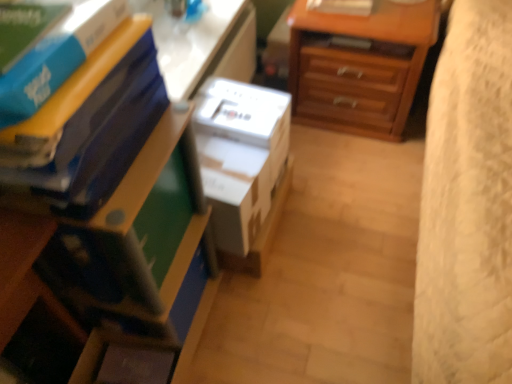
How much space does matte blue paperback book at left, the second paperback book in the back-to-front sequence, occupy horizontally?

matte blue paperback book at left, the second paperback book in the back-to-front sequence, is 12.07 inches in width.

Where is `blue matte book at upper left, the 1th paperback book in the front-to-back sequence`? blue matte book at upper left, the 1th paperback book in the front-to-back sequence is located at coordinates (57, 58).

I want to click on matte plastic nightstand at lower left, so click(127, 209).

Where is `matte blue paperback book at left, which ranks as the second paperback book in front-to-back order`? matte blue paperback book at left, which ranks as the second paperback book in front-to-back order is located at coordinates (90, 125).

Does blue matte book at upper left, the 1th paperback book in the front-to-back sequence, turn towards matte blue paperback book at left, the second paperback book in the back-to-front sequence?

No, blue matte book at upper left, the 1th paperback book in the front-to-back sequence, is not oriented towards matte blue paperback book at left, the second paperback book in the back-to-front sequence.

Consider the image. Between blue matte book at upper left, the 3th paperback book when ordered from back to front, and matte blue paperback book at left, which ranks as the second paperback book in front-to-back order, which one is positioned in front?

blue matte book at upper left, the 3th paperback book when ordered from back to front, is more forward.

Locate an element on the screen. The height and width of the screenshot is (384, 512). paperback book to the right of blue matte book at upper left, the 3th paperback book when ordered from back to front is located at coordinates (90, 125).

Does blue matte book at upper left, the 3th paperback book when ordered from back to front, appear on the right side of matte blue paperback book at left, the second paperback book in the back-to-front sequence?

Incorrect, blue matte book at upper left, the 3th paperback book when ordered from back to front, is not on the right side of matte blue paperback book at left, the second paperback book in the back-to-front sequence.

Is matte plastic nightstand at lower left placed right next to blue matte book at upper left, which appears as the 3th paperback book when viewed from the front?

No, matte plastic nightstand at lower left is not beside blue matte book at upper left, which appears as the 3th paperback book when viewed from the front.

Could blue matte book at upper left, placed as the first paperback book when sorted from back to front, be considered to be inside matte plastic nightstand at lower left?

No, blue matte book at upper left, placed as the first paperback book when sorted from back to front, is not a part of matte plastic nightstand at lower left.

Which of these two, matte plastic nightstand at lower left or blue matte book at upper left, which appears as the 3th paperback book when viewed from the front, is bigger?

matte plastic nightstand at lower left.

Is matte plastic nightstand at lower left facing away from blue matte book at upper left, placed as the first paperback book when sorted from back to front?

No, matte plastic nightstand at lower left is not facing the opposite direction of blue matte book at upper left, placed as the first paperback book when sorted from back to front.

Is white cardboard box at center positioned behind white plastic table at upper center?

No.

Would you say white cardboard box at center is inside or outside white plastic table at upper center?

The correct answer is: outside.

Which of these two, white cardboard box at center or white plastic table at upper center, is thinner?

white plastic table at upper center is thinner.

From the picture: Does matte plastic nightstand at lower left have a greater height compared to white cardboard box at center?

Correct, matte plastic nightstand at lower left is much taller as white cardboard box at center.

Could you tell me if matte plastic nightstand at lower left is turned towards white cardboard box at center?

No, matte plastic nightstand at lower left does not turn towards white cardboard box at center.

Which object is positioned more to the left, matte plastic nightstand at lower left or white cardboard box at center?

From the viewer's perspective, matte plastic nightstand at lower left appears more on the left side.

Can you confirm if matte plastic nightstand at lower left is smaller than white cardboard box at center?

No.

Which paperback book is the 2nd one when counting from the left side of the matte blue paperback book at left, which ranks as the second paperback book in front-to-back order? Please provide its 2D coordinates.

[(25, 28)]

Considering the relative sizes of matte blue paperback book at left, which ranks as the second paperback book in front-to-back order, and blue matte book at upper left, which appears as the 3th paperback book when viewed from the front, in the image provided, is matte blue paperback book at left, which ranks as the second paperback book in front-to-back order, bigger than blue matte book at upper left, which appears as the 3th paperback book when viewed from the front,?

Indeed, matte blue paperback book at left, which ranks as the second paperback book in front-to-back order, has a larger size compared to blue matte book at upper left, which appears as the 3th paperback book when viewed from the front.

Is matte blue paperback book at left, which ranks as the second paperback book in front-to-back order, outside of blue matte book at upper left, placed as the first paperback book when sorted from back to front?

Indeed, matte blue paperback book at left, which ranks as the second paperback book in front-to-back order, is completely outside blue matte book at upper left, placed as the first paperback book when sorted from back to front.

Is point (100, 96) positioned before point (212, 54)?

Yes, it is.

Considering the sizes of matte plastic nightstand at lower left and white plastic table at upper center in the image, is matte plastic nightstand at lower left taller or shorter than white plastic table at upper center?

matte plastic nightstand at lower left is taller than white plastic table at upper center.

Would you say matte plastic nightstand at lower left contains white plastic table at upper center?

No.

Based on their sizes in the image, would you say matte plastic nightstand at lower left is bigger or smaller than white plastic table at upper center?

matte plastic nightstand at lower left is bigger than white plastic table at upper center.

Is matte plastic nightstand at lower left beside blue matte book at upper left, the 3th paperback book when ordered from back to front?

No, matte plastic nightstand at lower left is not with blue matte book at upper left, the 3th paperback book when ordered from back to front.

Can you confirm if matte plastic nightstand at lower left is bigger than blue matte book at upper left, the 3th paperback book when ordered from back to front?

Indeed, matte plastic nightstand at lower left has a larger size compared to blue matte book at upper left, the 3th paperback book when ordered from back to front.

Can you tell me how much matte plastic nightstand at lower left and blue matte book at upper left, the 3th paperback book when ordered from back to front, differ in facing direction?

The facing directions of matte plastic nightstand at lower left and blue matte book at upper left, the 3th paperback book when ordered from back to front, are 0.000426 degrees apart.

From the image's perspective, is matte plastic nightstand at lower left positioned above or below blue matte book at upper left, the 3th paperback book when ordered from back to front?

Based on their image positions, matte plastic nightstand at lower left is located beneath blue matte book at upper left, the 3th paperback book when ordered from back to front.

Identify the location of paperback book below the blue matte book at upper left, the 3th paperback book when ordered from back to front (from a real-world perspective). (90, 125).

Where is `the 3rd paperback book to the left of the matte plastic nightstand at lower left, starting your count from the anchor`? The image size is (512, 384). the 3rd paperback book to the left of the matte plastic nightstand at lower left, starting your count from the anchor is located at coordinates (25, 28).

Estimate the real-world distances between objects in this image. Which object is closer to wooden chest of drawers at upper right, white cardboard box at center or blue matte book at upper left, placed as the first paperback book when sorted from back to front?

white cardboard box at center lies closer to wooden chest of drawers at upper right than the other object.

Based on their spatial positions, is wooden chest of drawers at upper right or matte plastic nightstand at lower left further from matte blue paperback book at left, the second paperback book in the back-to-front sequence?

Among the two, wooden chest of drawers at upper right is located further to matte blue paperback book at left, the second paperback book in the back-to-front sequence.

Based on their spatial positions, is white plastic table at upper center or wooden chest of drawers at upper right closer to matte plastic nightstand at lower left?

The object closer to matte plastic nightstand at lower left is white plastic table at upper center.

From the image, which object appears to be farther from blue matte book at upper left, the 3th paperback book when ordered from back to front, matte blue paperback book at left, the second paperback book in the back-to-front sequence, or blue matte book at upper left, which appears as the 3th paperback book when viewed from the front?

matte blue paperback book at left, the second paperback book in the back-to-front sequence, is further to blue matte book at upper left, the 3th paperback book when ordered from back to front.

Which object lies nearer to the anchor point matte plastic nightstand at lower left, wooden chest of drawers at upper right or white cardboard box at center?

white cardboard box at center is positioned closer to the anchor matte plastic nightstand at lower left.

From the image, which object appears to be nearer to blue matte book at upper left, placed as the first paperback book when sorted from back to front, blue matte book at upper left, the 1th paperback book in the front-to-back sequence, or white plastic table at upper center?

blue matte book at upper left, the 1th paperback book in the front-to-back sequence, is closer to blue matte book at upper left, placed as the first paperback book when sorted from back to front.

From the image, which object appears to be nearer to matte blue paperback book at left, which ranks as the second paperback book in front-to-back order, blue matte book at upper left, the 3th paperback book when ordered from back to front, or white cardboard box at center?

blue matte book at upper left, the 3th paperback book when ordered from back to front, is closer to matte blue paperback book at left, which ranks as the second paperback book in front-to-back order.

Looking at the image, which one is located closer to blue matte book at upper left, placed as the first paperback book when sorted from back to front, matte blue paperback book at left, the second paperback book in the back-to-front sequence, or blue matte book at upper left, the 3th paperback book when ordered from back to front?

Among the two, blue matte book at upper left, the 3th paperback book when ordered from back to front, is located nearer to blue matte book at upper left, placed as the first paperback book when sorted from back to front.

Identify the location of table situated between matte plastic nightstand at lower left and wooden chest of drawers at upper right from left to right. This screenshot has width=512, height=384. (205, 45).

Locate an element on the screen. The height and width of the screenshot is (384, 512). nightstand between blue matte book at upper left, which appears as the 3th paperback book when viewed from the front, and white plastic table at upper center in the front-back direction is located at coordinates (127, 209).

Find the location of `nightstand located between matte blue paperback book at left, the second paperback book in the back-to-front sequence, and wooden chest of drawers at upper right in the depth direction`. nightstand located between matte blue paperback book at left, the second paperback book in the back-to-front sequence, and wooden chest of drawers at upper right in the depth direction is located at coordinates (127, 209).

Find the location of `nightstand positioned between matte blue paperback book at left, which ranks as the second paperback book in front-to-back order, and white cardboard box at center from near to far`. nightstand positioned between matte blue paperback book at left, which ranks as the second paperback book in front-to-back order, and white cardboard box at center from near to far is located at coordinates (127, 209).